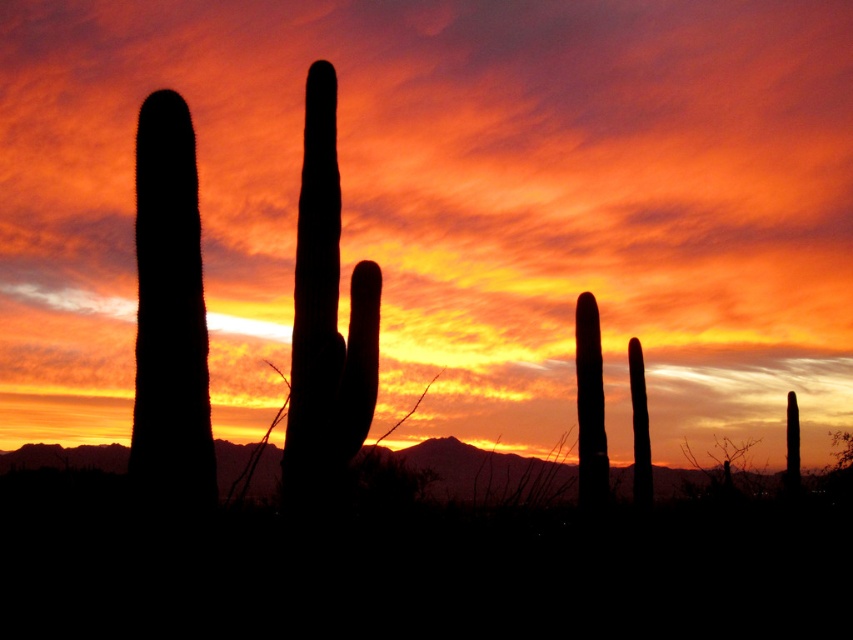
Can you confirm if black matte cactus at left is positioned to the left of silhouette cactus at center?

Yes, black matte cactus at left is to the left of silhouette cactus at center.

Does black matte cactus at left have a lesser width compared to silhouette cactus at center?

Yes.

Image resolution: width=853 pixels, height=640 pixels. What are the coordinates of `black matte cactus at left` in the screenshot? It's located at (169, 316).

Can you confirm if black matte cactus at left is thinner than silhouette cactus at right?

In fact, black matte cactus at left might be wider than silhouette cactus at right.

Who is more forward, (137, 308) or (585, 438)?

Point (137, 308) is more forward.

Where is `black matte cactus at left`? The image size is (853, 640). black matte cactus at left is located at coordinates (169, 316).

How distant is silhouette cactus at center from silhouette cactus at right?

silhouette cactus at center and silhouette cactus at right are 14.86 feet apart.

In the scene shown: Can you confirm if silhouette cactus at center is thinner than silhouette cactus at right?

Incorrect, silhouette cactus at center's width is not less than silhouette cactus at right's.

Describe the element at coordinates (326, 317) in the screenshot. This screenshot has width=853, height=640. I see `silhouette cactus at center` at that location.

Identify the location of silhouette cactus at center. The height and width of the screenshot is (640, 853). pos(326,317).